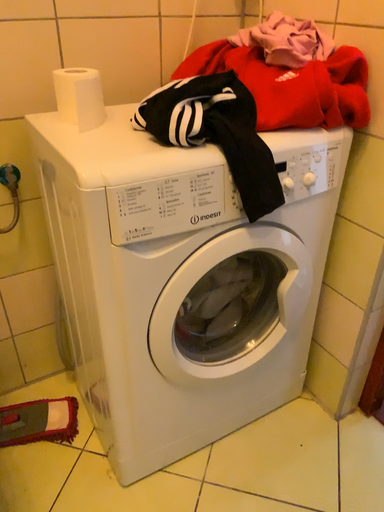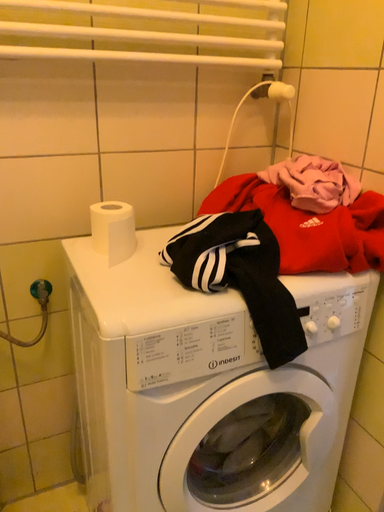
Question: Which way did the camera rotate in the video?

Choices:
 (A) rotated upward
 (B) rotated downward

Answer: (A)